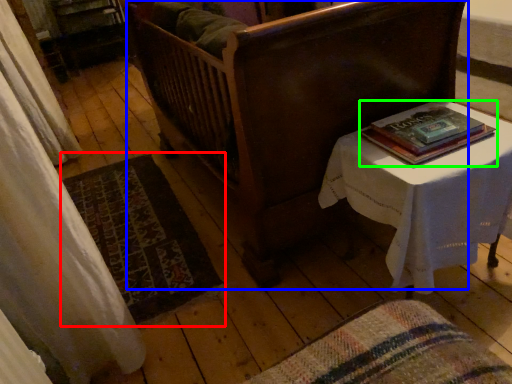
Question: Based on their relative distances, which object is farther from mat (highlighted by a red box)? Choose from furniture (highlighted by a blue box) and book (highlighted by a green box).

Choices:
 (A) furniture
 (B) book

Answer: (B)